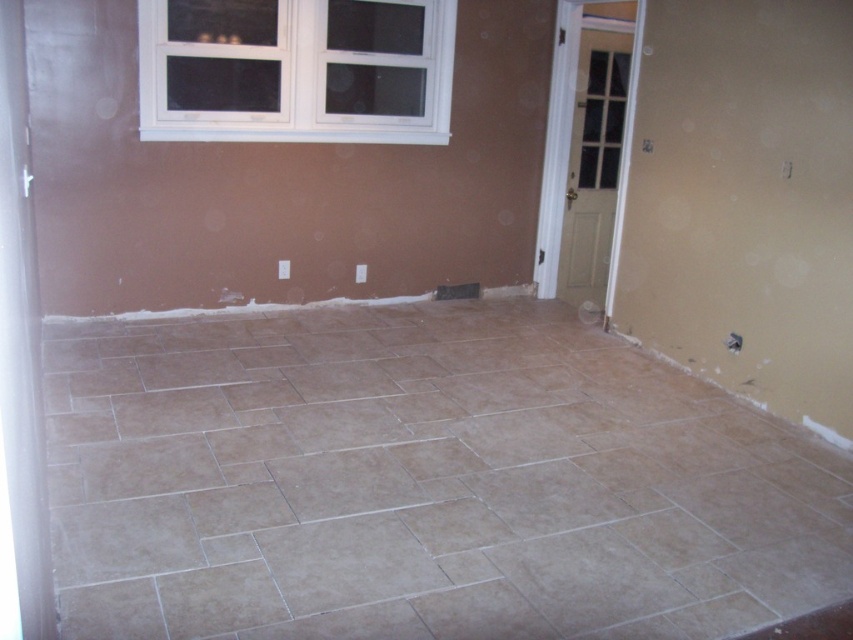
Question: Does beige tile at center come in front of white plastic window at upper center?

Choices:
 (A) no
 (B) yes

Answer: (B)

Question: Which point is farther to the camera?

Choices:
 (A) beige tile at center
 (B) white plastic window at upper center

Answer: (B)

Question: Is beige tile at center to the left of white plastic window at upper center from the viewer's perspective?

Choices:
 (A) no
 (B) yes

Answer: (A)

Question: Does beige tile at center appear over white plastic window at upper center?

Choices:
 (A) yes
 (B) no

Answer: (B)

Question: Which of the following is the farthest from the observer?

Choices:
 (A) (357, 12)
 (B) (524, 580)

Answer: (A)

Question: Among these points, which one is farthest from the camera?

Choices:
 (A) (273, 516)
 (B) (341, 93)

Answer: (B)